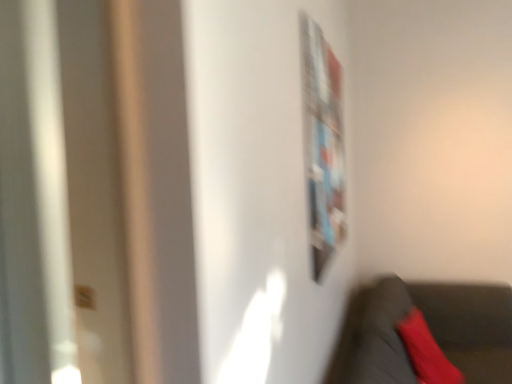
The image size is (512, 384). What do you see at coordinates (424, 334) in the screenshot?
I see `velvet black chair at lower right` at bounding box center [424, 334].

Identify the location of velvet red pillow at lower right. Image resolution: width=512 pixels, height=384 pixels. (426, 352).

Find the location of a particular element. The height and width of the screenshot is (384, 512). metallic silver bulletin board at upper right is located at coordinates click(x=322, y=144).

Is velvet black chair at lower right oriented away from velvet red pillow at lower right?

Yes, velvet red pillow at lower right is at the back of velvet black chair at lower right.

Considering the sizes of objects velvet black chair at lower right and velvet red pillow at lower right in the image provided, who is thinner, velvet black chair at lower right or velvet red pillow at lower right?

With smaller width is velvet red pillow at lower right.

Considering the relative sizes of velvet black chair at lower right and velvet red pillow at lower right in the image provided, is velvet black chair at lower right smaller than velvet red pillow at lower right?

Actually, velvet black chair at lower right might be larger than velvet red pillow at lower right.

Considering the positions of objects metallic silver bulletin board at upper right and velvet black chair at lower right in the image provided, who is in front, metallic silver bulletin board at upper right or velvet black chair at lower right?

velvet black chair at lower right is more forward.

Is velvet black chair at lower right a part of metallic silver bulletin board at upper right?

Actually, velvet black chair at lower right is outside metallic silver bulletin board at upper right.

Can you tell me how much metallic silver bulletin board at upper right and velvet black chair at lower right differ in facing direction?

The angle between the facing direction of metallic silver bulletin board at upper right and the facing direction of velvet black chair at lower right is 0.286 degrees.

From a real-world perspective, is metallic silver bulletin board at upper right on velvet black chair at lower right?

Yes, from a real-world perspective, metallic silver bulletin board at upper right is over velvet black chair at lower right

Is velvet red pillow at lower right not inside metallic silver bulletin board at upper right?

Indeed, velvet red pillow at lower right is completely outside metallic silver bulletin board at upper right.

At what (x,y) coordinates should I click in order to perform the action: click on pillow on the right of metallic silver bulletin board at upper right. Please return your answer as a coordinate pair (x, y). The height and width of the screenshot is (384, 512). Looking at the image, I should click on (426, 352).

Based on their sizes in the image, would you say velvet red pillow at lower right is bigger or smaller than metallic silver bulletin board at upper right?

Considering their sizes, velvet red pillow at lower right takes up more space than metallic silver bulletin board at upper right.

Is velvet red pillow at lower right turned away from metallic silver bulletin board at upper right?

No, velvet red pillow at lower right is not facing away from metallic silver bulletin board at upper right.

Is velvet black chair at lower right turned away from metallic silver bulletin board at upper right?

That's not correct — velvet black chair at lower right is not looking away from metallic silver bulletin board at upper right.

Does velvet black chair at lower right have a larger size compared to metallic silver bulletin board at upper right?

Correct, velvet black chair at lower right is larger in size than metallic silver bulletin board at upper right.

From the image's perspective, is velvet black chair at lower right above metallic silver bulletin board at upper right?

Incorrect, from the image's perspective, velvet black chair at lower right is lower than metallic silver bulletin board at upper right.

This screenshot has height=384, width=512. Identify the location of bulletin board positioned vertically above the velvet black chair at lower right (from a real-world perspective). (322, 144).

Does metallic silver bulletin board at upper right contain velvet red pillow at lower right?

Definitely not — velvet red pillow at lower right is not inside metallic silver bulletin board at upper right.

Can you tell me how much metallic silver bulletin board at upper right and velvet red pillow at lower right differ in facing direction?

metallic silver bulletin board at upper right and velvet red pillow at lower right are facing 14 degrees away from each other.

Is metallic silver bulletin board at upper right facing towards velvet red pillow at lower right?

No, metallic silver bulletin board at upper right is not turned towards velvet red pillow at lower right.

From the image's perspective, is metallic silver bulletin board at upper right above velvet red pillow at lower right?

Correct, metallic silver bulletin board at upper right appears higher than velvet red pillow at lower right in the image.

From the image's perspective, relative to velvet black chair at lower right, is velvet red pillow at lower right above or below?

Clearly, from the image's perspective, velvet red pillow at lower right is above velvet black chair at lower right.

Between velvet red pillow at lower right and velvet black chair at lower right, which one appears on the left side from the viewer's perspective?

Positioned to the left is velvet red pillow at lower right.

Is velvet red pillow at lower right facing away from velvet black chair at lower right?

Yes.

Which is in front, point (411, 361) or point (500, 370)?

The point (411, 361) is closer.

Locate an element on the screen. The width and height of the screenshot is (512, 384). chair on the right side of velvet red pillow at lower right is located at coordinates (424, 334).

Find the location of a particular element. chair below the metallic silver bulletin board at upper right (from a real-world perspective) is located at coordinates (424, 334).

Considering their positions, is velvet black chair at lower right positioned further to velvet red pillow at lower right than metallic silver bulletin board at upper right?

metallic silver bulletin board at upper right is positioned further to the anchor velvet red pillow at lower right.

In the scene shown: Based on their spatial positions, is velvet black chair at lower right or velvet red pillow at lower right closer to metallic silver bulletin board at upper right?

The object closer to metallic silver bulletin board at upper right is velvet black chair at lower right.

From the image, which object appears to be nearer to velvet black chair at lower right, velvet red pillow at lower right or metallic silver bulletin board at upper right?

velvet red pillow at lower right is positioned closer to the anchor velvet black chair at lower right.

Considering their positions, is metallic silver bulletin board at upper right positioned closer to velvet red pillow at lower right than velvet black chair at lower right?

velvet black chair at lower right is closer to velvet red pillow at lower right.

Estimate the real-world distances between objects in this image. Which object is further from velvet black chair at lower right, metallic silver bulletin board at upper right or velvet red pillow at lower right?

The object further to velvet black chair at lower right is metallic silver bulletin board at upper right.

Looking at this image, estimate the real-world distances between objects in this image. Which object is further from metallic silver bulletin board at upper right, velvet red pillow at lower right or velvet black chair at lower right?

Based on the image, velvet red pillow at lower right appears to be further to metallic silver bulletin board at upper right.

Image resolution: width=512 pixels, height=384 pixels. In order to click on pillow between metallic silver bulletin board at upper right and velvet black chair at lower right vertically in this screenshot , I will do `click(426, 352)`.